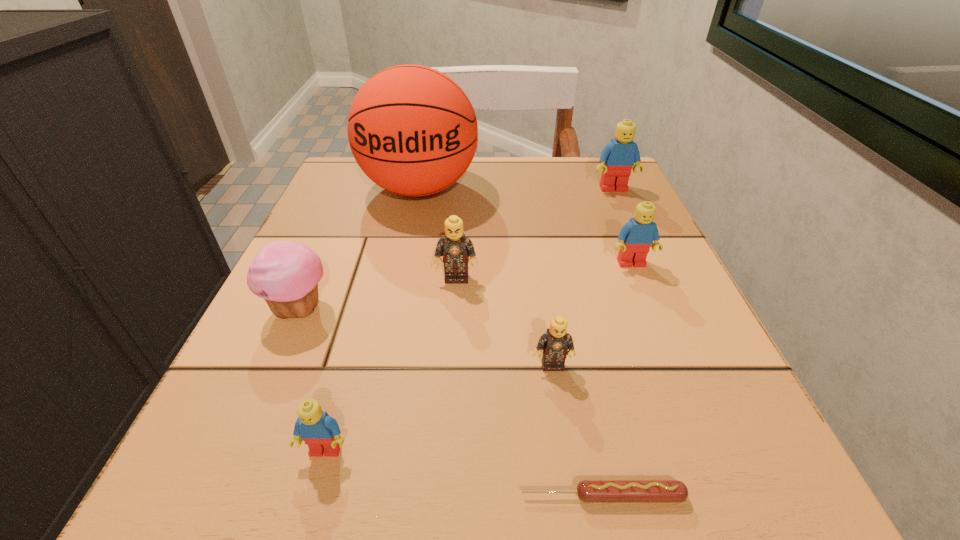
Locate an element on the screen. sausage at the right edge is located at coordinates (589, 491).

Find the location of a particular element. The width and height of the screenshot is (960, 540). object situated at the far left corner is located at coordinates (413, 131).

Locate an element on the screen. The image size is (960, 540). object located in the near left corner section of the desktop is located at coordinates (318, 430).

Find the location of a particular element. The image size is (960, 540). object located at the far right corner is located at coordinates (618, 157).

This screenshot has height=540, width=960. In order to click on object positioned at the near right corner in this screenshot , I will do `click(589, 491)`.

I want to click on free space at the far edge of the desktop, so click(x=442, y=207).

Identify the location of vacant space at the near edge. The image size is (960, 540). (471, 446).

Identify the location of vacant region at the left edge of the desktop. (275, 388).

This screenshot has width=960, height=540. I want to click on vacant area at the right edge of the desktop, so click(575, 250).

In the image, there is a desktop. What are the coordinates of `vacant space at the far right corner` in the screenshot? It's located at (591, 184).